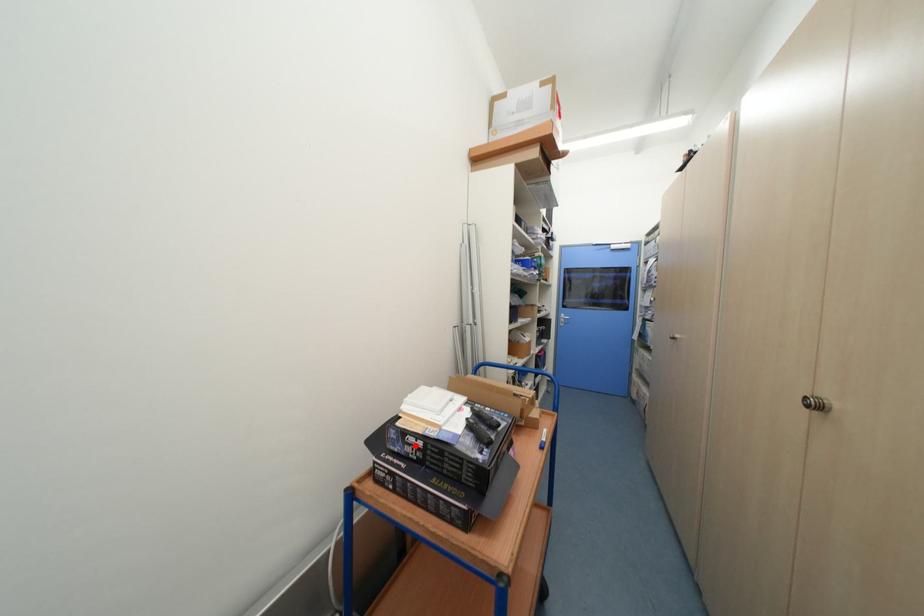
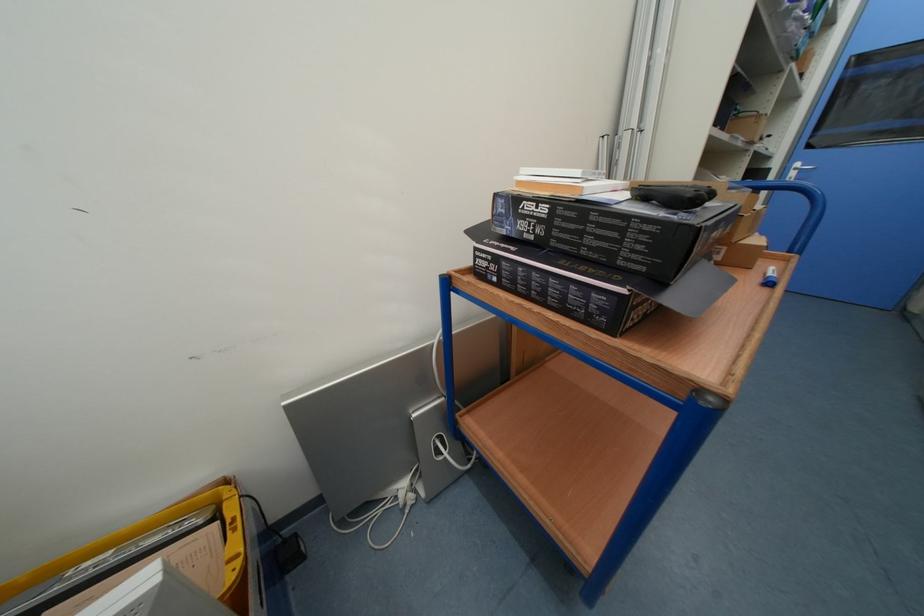
The point at the highlighted location is marked in the first image. Where is the corresponding point in the second image?

(530, 217)